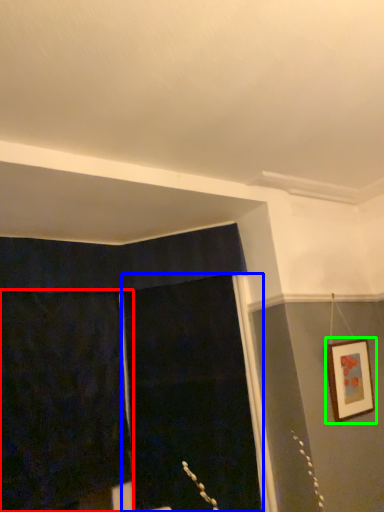
Question: Which is farther away from curtain (highlighted by a red box)? screen door (highlighted by a blue box) or picture frame (highlighted by a green box)?

Choices:
 (A) screen door
 (B) picture frame

Answer: (B)